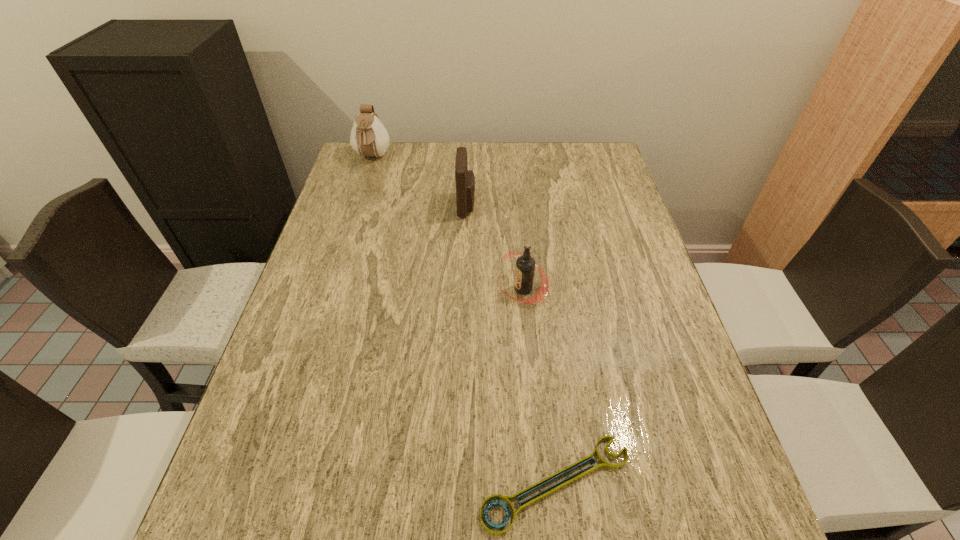
This screenshot has width=960, height=540. Find the location of `object that is the second closest one to the wrench`. object that is the second closest one to the wrench is located at coordinates (465, 180).

Identify which object is located as the second nearest to the second farthest object. Please provide its 2D coordinates. Your answer should be formatted as a tuple, i.e. [(x, y)], where the tuple contains the x and y coordinates of a point satisfying the conditions above.

[(369, 138)]

You are a GUI agent. You are given a task and a screenshot of the screen. Output one action in this format:
    pyautogui.click(x=<x>, y=<y>)
    Task: Click on the vacant region that satisfies the following two spatial constraints: 1. on the front-facing side of the wrench; 2. on the right side of the farther pouch
    
    Given the screenshot: What is the action you would take?
    pyautogui.click(x=268, y=483)

The height and width of the screenshot is (540, 960). In order to click on vacant position in the image that satisfies the following two spatial constraints: 1. on the front-facing side of the farther pouch; 2. on the left side of the shortest object in this screenshot , I will do `click(268, 483)`.

I want to click on free region that satisfies the following two spatial constraints: 1. on the label of the root beer; 2. on the left side of the shortest object, so click(x=540, y=483).

Locate an element on the screen. Image resolution: width=960 pixels, height=540 pixels. free spot that satisfies the following two spatial constraints: 1. on the label of the second nearest object; 2. on the back side of the nearest object is located at coordinates (540, 483).

Find the location of `free space that satisfies the following two spatial constraints: 1. with an open flap on the nearer pouch; 2. on the back side of the shortest object`. free space that satisfies the following two spatial constraints: 1. with an open flap on the nearer pouch; 2. on the back side of the shortest object is located at coordinates (457, 483).

The height and width of the screenshot is (540, 960). I want to click on vacant space that satisfies the following two spatial constraints: 1. on the front-facing side of the shortest object; 2. on the left side of the left pouch, so point(268,483).